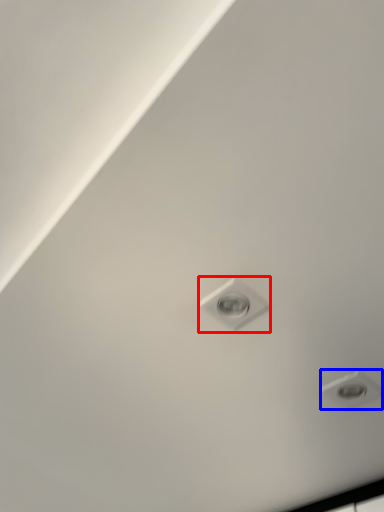
Question: Which of the following is the closest to the observer, light bulb (highlighted by a red box) or droplight (highlighted by a blue box)?

Choices:
 (A) light bulb
 (B) droplight

Answer: (A)